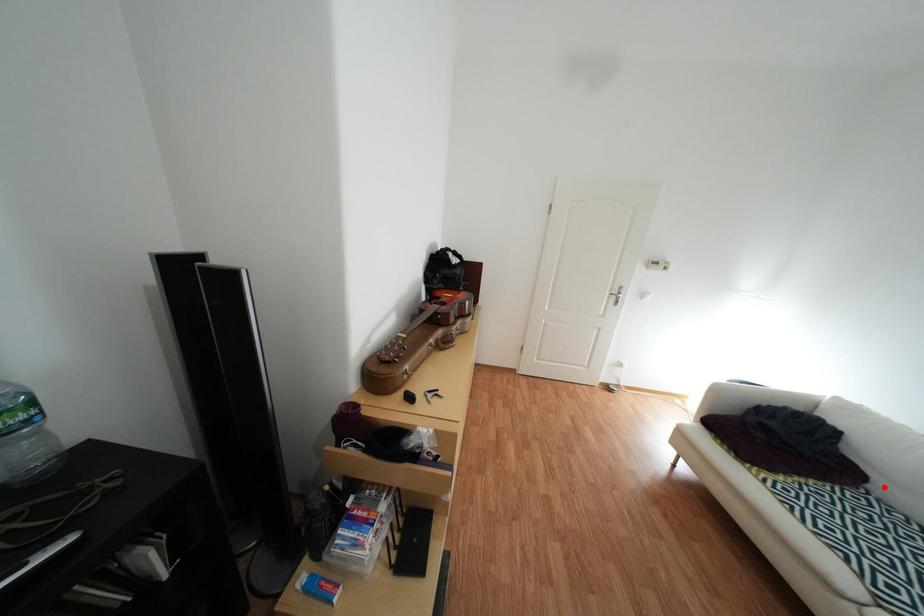
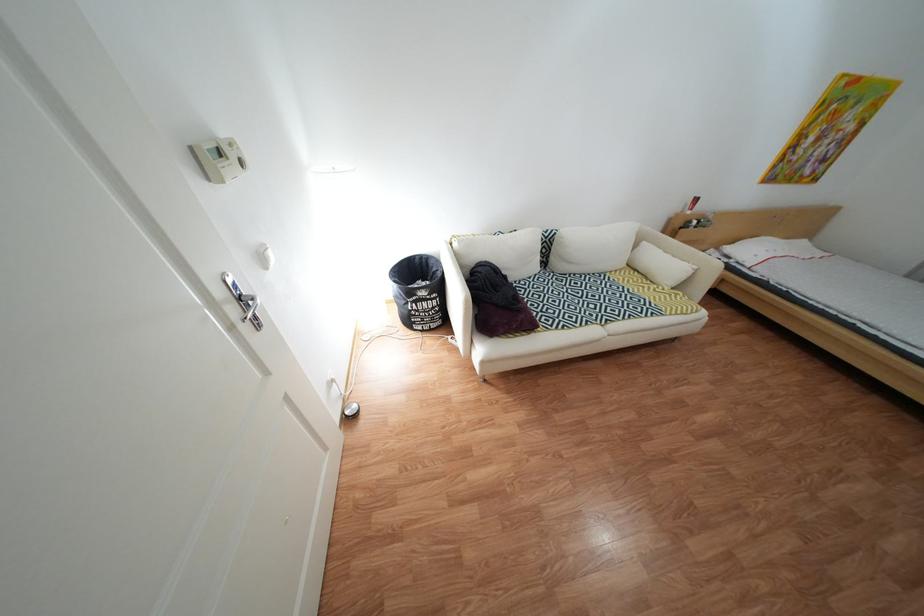
The point at the highlighted location is marked in the first image. Where is the corresponding point in the second image?

(525, 281)